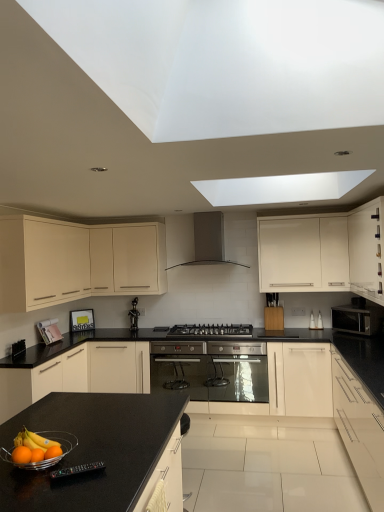
Question: Considering the relative positions of orange matte at lower left and white glossy cabinet at right, positioned as the 5th cabinetry in left-to-right order, in the image provided, is orange matte at lower left in front of white glossy cabinet at right, positioned as the 5th cabinetry in left-to-right order,?

Choices:
 (A) no
 (B) yes

Answer: (B)

Question: Is there a large distance between orange matte at lower left and white glossy cabinet at right, positioned as the 5th cabinetry in left-to-right order?

Choices:
 (A) yes
 (B) no

Answer: (A)

Question: Can you confirm if orange matte at lower left is taller than white glossy cabinet at right, the second cabinetry from the right?

Choices:
 (A) yes
 (B) no

Answer: (B)

Question: Can you confirm if orange matte at lower left is positioned to the left of white glossy cabinet at right, the second cabinetry from the right?

Choices:
 (A) yes
 (B) no

Answer: (A)

Question: Is orange matte at lower left looking in the opposite direction of white glossy cabinet at right, positioned as the 5th cabinetry in left-to-right order?

Choices:
 (A) no
 (B) yes

Answer: (A)

Question: From a real-world perspective, is white matte cabinet at lower left, which is the fifth cabinetry in right-to-left order, positioned above or below black glossy statue at center, the 1th appliance when ordered from back to front?

Choices:
 (A) above
 (B) below

Answer: (B)

Question: Does point (97, 343) appear closer or farther from the camera than point (135, 322)?

Choices:
 (A) closer
 (B) farther

Answer: (A)

Question: From the image's perspective, is white matte cabinet at lower left, positioned as the second cabinetry in left-to-right order, located above or below black glossy statue at center, the third appliance from the front?

Choices:
 (A) above
 (B) below

Answer: (B)

Question: Considering their positions, is white matte cabinet at lower left, positioned as the second cabinetry in left-to-right order, located in front of or behind black glossy statue at center, which ranks as the third appliance in right-to-left order?

Choices:
 (A) front
 (B) behind

Answer: (A)

Question: Considering the positions of point (206, 225) and point (130, 356), is point (206, 225) closer or farther from the camera than point (130, 356)?

Choices:
 (A) farther
 (B) closer

Answer: (A)

Question: Choose the correct answer: Is satin silver range hood at center inside white matte cabinet at lower left, positioned as the second cabinetry in left-to-right order, or outside it?

Choices:
 (A) outside
 (B) inside

Answer: (A)

Question: Relative to white matte cabinet at lower left, positioned as the second cabinetry in left-to-right order, is satin silver range hood at center in front or behind?

Choices:
 (A) front
 (B) behind

Answer: (B)

Question: Based on their sizes in the image, would you say satin silver range hood at center is bigger or smaller than white matte cabinet at lower left, which is the fifth cabinetry in right-to-left order?

Choices:
 (A) small
 (B) big

Answer: (A)

Question: Visually, is stainless steel oven at center, the third appliance positioned from the top, positioned to the left or to the right of black plastic remote control at lower left, which appears as the second appliance when viewed from the left?

Choices:
 (A) left
 (B) right

Answer: (B)

Question: Relative to black plastic remote control at lower left, arranged as the third appliance when viewed from the back, is stainless steel oven at center, the third appliance positioned from the top, in front or behind?

Choices:
 (A) behind
 (B) front

Answer: (A)